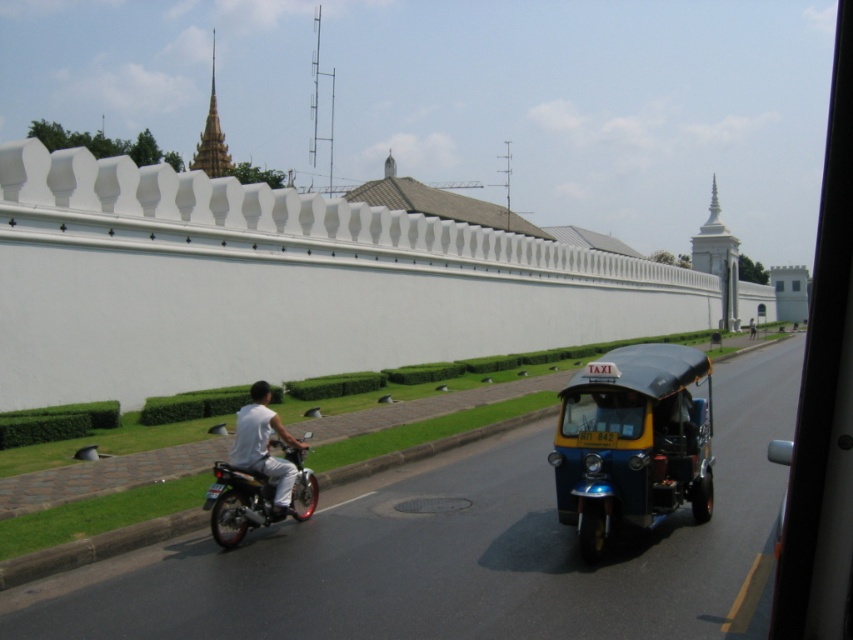
Is blue metallic tuk-tuk at center to the left of white matte motorcycle at lower left from the viewer's perspective?

In fact, blue metallic tuk-tuk at center is to the right of white matte motorcycle at lower left.

Is blue metallic tuk-tuk at center thinner than white matte motorcycle at lower left?

Incorrect, blue metallic tuk-tuk at center's width is not less than white matte motorcycle at lower left's.

Locate an element on the screen. This screenshot has height=640, width=853. blue metallic tuk-tuk at center is located at coordinates (631, 442).

You are a GUI agent. You are given a task and a screenshot of the screen. Output one action in this format:
    pyautogui.click(x=<x>, y=<y>)
    Task: Click on the blue metallic tuk-tuk at center
    Image resolution: width=853 pixels, height=640 pixels.
    Given the screenshot: What is the action you would take?
    pyautogui.click(x=631, y=442)

Which is behind, point (242, 480) or point (262, 467)?

Positioned behind is point (262, 467).

Can you confirm if shiny black motorcycle at lower left is positioned below white matte motorcycle at lower left?

Yes, shiny black motorcycle at lower left is below white matte motorcycle at lower left.

Is point (247, 496) less distant than point (273, 460)?

That is True.

At what (x,y) coordinates should I click in order to perform the action: click on shiny black motorcycle at lower left. Please return your answer as a coordinate pair (x, y). Looking at the image, I should click on (238, 502).

Can you confirm if blue metallic tuk-tuk at center is positioned below shiny black motorcycle at lower left?

No.

Is point (665, 461) behind point (242, 490)?

No, (665, 461) is closer to viewer.

Is point (570, 384) positioned in front of point (292, 516)?

No, (570, 384) is further to viewer.

This screenshot has height=640, width=853. I want to click on blue metallic tuk-tuk at center, so click(631, 442).